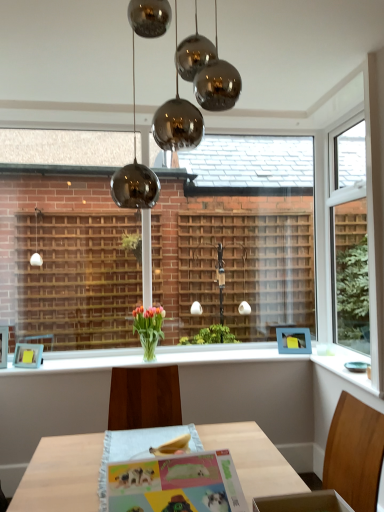
Image resolution: width=384 pixels, height=512 pixels. What do you see at coordinates (177, 485) in the screenshot?
I see `matte paper postcard at center` at bounding box center [177, 485].

At what (x,y) coordinates should I click in order to perform the action: click on white glossy window sill at center, positioned as the second window sill in right-to-left order. Please return your answer as a coordinate pair (x, y). Looking at the image, I should click on coord(188,357).

Identify the location of white glossy plate at lower right, acting as the 2th window sill starting from the left. click(x=344, y=365).

Based on the photo, how much space does blue matte picture frame at upper right, which is counted as the second picture frame, starting from the front, occupy vertically?

The height of blue matte picture frame at upper right, which is counted as the second picture frame, starting from the front, is 10.24 inches.

The width and height of the screenshot is (384, 512). What do you see at coordinates (28, 355) in the screenshot?
I see `matte blue picture frame at lower left, the 1th picture frame when ordered from left to right` at bounding box center [28, 355].

I want to click on matte paper postcard at center, so click(x=177, y=485).

Who is smaller, white glossy plate at lower right, the 1th window sill viewed from the right, or translucent glass vase at center?

white glossy plate at lower right, the 1th window sill viewed from the right.

Between white glossy plate at lower right, acting as the 2th window sill starting from the left, and translucent glass vase at center, which one is positioned behind?

translucent glass vase at center is behind.

How distant is white glossy plate at lower right, the 1th window sill viewed from the right, from translucent glass vase at center?

They are 1.21 meters apart.

Is white glossy plate at lower right, the 1th window sill viewed from the right, in contact with translucent glass vase at center?

There is a gap between white glossy plate at lower right, the 1th window sill viewed from the right, and translucent glass vase at center.

Is matte paper postcard at center inside or outside of matte blue picture frame at lower left, marked as the first picture frame in a front-to-back arrangement?

matte paper postcard at center is not enclosed by matte blue picture frame at lower left, marked as the first picture frame in a front-to-back arrangement.

Based on the photo, is matte paper postcard at center looking in the opposite direction of matte blue picture frame at lower left, the second picture frame when ordered from right to left?

matte paper postcard at center is not turned away from matte blue picture frame at lower left, the second picture frame when ordered from right to left.

Which point is more distant from viewer, [177,490] or [38,365]?

Point [38,365]

The height and width of the screenshot is (512, 384). I want to click on bay window that appears behind the white glossy plate at lower right, acting as the 2th window sill starting from the left, so click(x=237, y=236).

Is white glossy plate at lower right, the 1th window sill viewed from the right, behind matte glass vase at center?

No, white glossy plate at lower right, the 1th window sill viewed from the right, is closer to the viewer.

Does white glossy plate at lower right, the 1th window sill viewed from the right, turn towards matte glass vase at center?

No, white glossy plate at lower right, the 1th window sill viewed from the right, is not facing towards matte glass vase at center.

Is white glossy plate at lower right, the 1th window sill viewed from the right, taller or shorter than matte glass vase at center?

In the image, white glossy plate at lower right, the 1th window sill viewed from the right, appears to be shorter than matte glass vase at center.

Between white glossy window sill at center, positioned as the second window sill in right-to-left order, and matte blue picture frame at lower left, marked as the first picture frame in a front-to-back arrangement, which one is positioned in front?

white glossy window sill at center, positioned as the second window sill in right-to-left order, is more forward.

Looking at this image, how distant is white glossy window sill at center, placed as the 1th window sill when sorted from left to right, from matte blue picture frame at lower left, marked as the first picture frame in a front-to-back arrangement?

31.96 inches.

Based on the photo, between white glossy window sill at center, positioned as the second window sill in right-to-left order, and matte blue picture frame at lower left, the second picture frame when ordered from right to left, which one has larger size?

white glossy window sill at center, positioned as the second window sill in right-to-left order, is bigger.

Is white glossy window sill at center, positioned as the second window sill in right-to-left order, positioned far away from matte blue picture frame at lower left, marked as the first picture frame in a front-to-back arrangement?

No, white glossy window sill at center, positioned as the second window sill in right-to-left order, is not far from matte blue picture frame at lower left, marked as the first picture frame in a front-to-back arrangement.

Can you confirm if matte blue picture frame at lower left, the second picture frame when ordered from right to left, is positioned to the right of polished chrome chandelier at upper center?

In fact, matte blue picture frame at lower left, the second picture frame when ordered from right to left, is to the left of polished chrome chandelier at upper center.

Is point (28, 366) closer to camera compared to point (157, 187)?

Yes, point (28, 366) is in front of point (157, 187).

In the scene shown: Who is shorter, matte blue picture frame at lower left, the 1th picture frame when ordered from left to right, or polished chrome chandelier at upper center?

matte blue picture frame at lower left, the 1th picture frame when ordered from left to right, is shorter.

In the scene shown: Which of these two, white glossy plate at lower right, the 1th window sill viewed from the right, or matte paper postcard at center, is bigger?

matte paper postcard at center.

Which is in front, point (375, 396) or point (126, 504)?

Positioned in front is point (126, 504).

Is white glossy plate at lower right, the 1th window sill viewed from the right, to the right of matte paper postcard at center from the viewer's perspective?

Yes.

In the scene shown: Are white glossy plate at lower right, the 1th window sill viewed from the right, and matte paper postcard at center located far from each other?

Yes, white glossy plate at lower right, the 1th window sill viewed from the right, is far from matte paper postcard at center.

Considering the sizes of objects matte blue picture frame at lower left, marked as the first picture frame in a front-to-back arrangement, and matte paper postcard at center in the image provided, who is thinner, matte blue picture frame at lower left, marked as the first picture frame in a front-to-back arrangement, or matte paper postcard at center?

With smaller width is matte blue picture frame at lower left, marked as the first picture frame in a front-to-back arrangement.

In the scene shown: Does matte blue picture frame at lower left, marked as the first picture frame in a front-to-back arrangement, have a smaller size compared to matte paper postcard at center?

Correct, matte blue picture frame at lower left, marked as the first picture frame in a front-to-back arrangement, occupies less space than matte paper postcard at center.

Could you tell me if matte blue picture frame at lower left, marked as the first picture frame in a front-to-back arrangement, is turned towards matte paper postcard at center?

No, matte blue picture frame at lower left, marked as the first picture frame in a front-to-back arrangement, is not turned towards matte paper postcard at center.

Is point (17, 353) more distant than point (199, 501)?

Yes, it is behind point (199, 501).

You are a GUI agent. You are given a task and a screenshot of the screen. Output one action in this format:
    pyautogui.click(x=<x>, y=<y>)
    Task: Click on the flower located above the white glossy plate at lower right, the 1th window sill viewed from the right (from a real-world perspective)
    This screenshot has height=512, width=384.
    Given the screenshot: What is the action you would take?
    pyautogui.click(x=149, y=322)

The width and height of the screenshot is (384, 512). Identify the location of postcard located below the matte blue picture frame at lower left, the 2th picture frame viewed from the back (from the image's perspective). [x=177, y=485].

Looking at the image, which one is located further to translucent glass vase at center, white glossy plate at lower right, the 1th window sill viewed from the right, or polished chrome chandelier at upper center?

Among the two, white glossy plate at lower right, the 1th window sill viewed from the right, is located further to translucent glass vase at center.

Based on the photo, when comparing their distances from blue matte picture frame at upper right, which is counted as the second picture frame, starting from the front, does white glossy plate at lower right, the 1th window sill viewed from the right, or matte paper postcard at center seem closer?

white glossy plate at lower right, the 1th window sill viewed from the right.

Considering their positions, is white glossy window sill at center, placed as the 1th window sill when sorted from left to right, positioned closer to white glossy plate at lower right, acting as the 2th window sill starting from the left, than matte glass vase at center?

The object closer to white glossy plate at lower right, acting as the 2th window sill starting from the left, is white glossy window sill at center, placed as the 1th window sill when sorted from left to right.

Estimate the real-world distances between objects in this image. Which object is further from translucent glass vase at center, matte paper postcard at center or blue matte picture frame at upper right, placed as the first picture frame when sorted from right to left?

Among the two, matte paper postcard at center is located further to translucent glass vase at center.

From the image, which object appears to be farther from matte glass vase at center, matte paper postcard at center or matte blue picture frame at lower left, the second picture frame when ordered from right to left?

matte paper postcard at center is further to matte glass vase at center.

Considering their positions, is white glossy window sill at center, positioned as the second window sill in right-to-left order, positioned further to matte blue picture frame at lower left, the 1th picture frame when ordered from left to right, than translucent glass vase at center?

white glossy window sill at center, positioned as the second window sill in right-to-left order.

Looking at the image, which one is located further to white glossy window sill at center, positioned as the second window sill in right-to-left order, polished chrome chandelier at upper center or matte glass vase at center?

Among the two, polished chrome chandelier at upper center is located further to white glossy window sill at center, positioned as the second window sill in right-to-left order.

Estimate the real-world distances between objects in this image. Which object is further from white glossy window sill at center, placed as the 1th window sill when sorted from left to right, matte paper postcard at center or blue matte picture frame at upper right, placed as the first picture frame when sorted from right to left?

matte paper postcard at center.

The height and width of the screenshot is (512, 384). Find the location of `flower between matte blue picture frame at lower left, the 1th picture frame when ordered from left to right, and matte glass vase at center, in the horizontal direction`. flower between matte blue picture frame at lower left, the 1th picture frame when ordered from left to right, and matte glass vase at center, in the horizontal direction is located at coordinates (149, 322).

This screenshot has height=512, width=384. I want to click on window sill situated between translucent glass vase at center and blue matte picture frame at upper right, positioned as the first picture frame in back-to-front order, from left to right, so coord(188,357).

At what (x,y) coordinates should I click in order to perform the action: click on flower positioned between polished chrome chandelier at upper center and blue matte picture frame at upper right, positioned as the first picture frame in back-to-front order, from near to far. Please return your answer as a coordinate pair (x, y). Image resolution: width=384 pixels, height=512 pixels. Looking at the image, I should click on (149, 322).

Where is `bay window between matte blue picture frame at lower left, marked as the first picture frame in a front-to-back arrangement, and white glossy plate at lower right, the 1th window sill viewed from the right, in the horizontal direction`? Image resolution: width=384 pixels, height=512 pixels. bay window between matte blue picture frame at lower left, marked as the first picture frame in a front-to-back arrangement, and white glossy plate at lower right, the 1th window sill viewed from the right, in the horizontal direction is located at coordinates (237, 236).